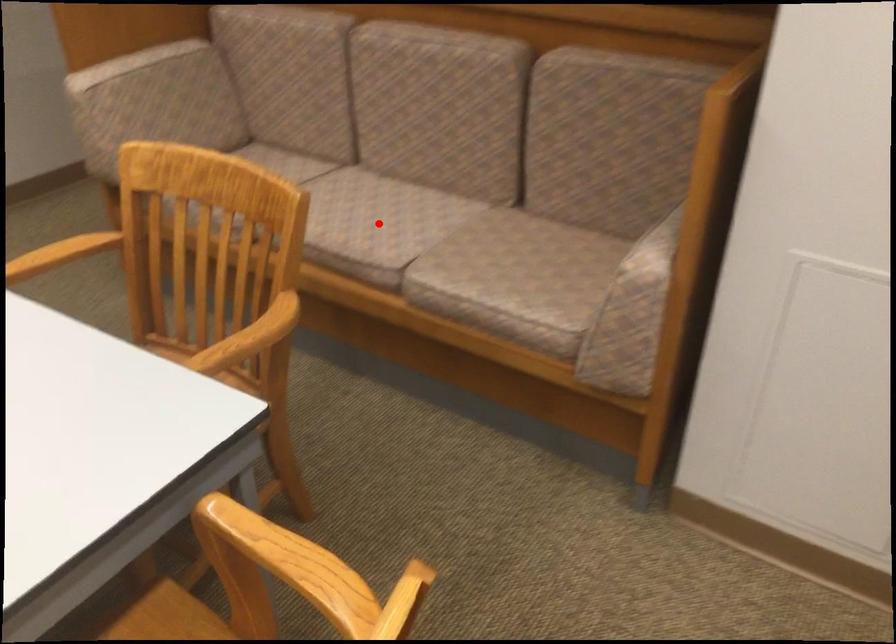
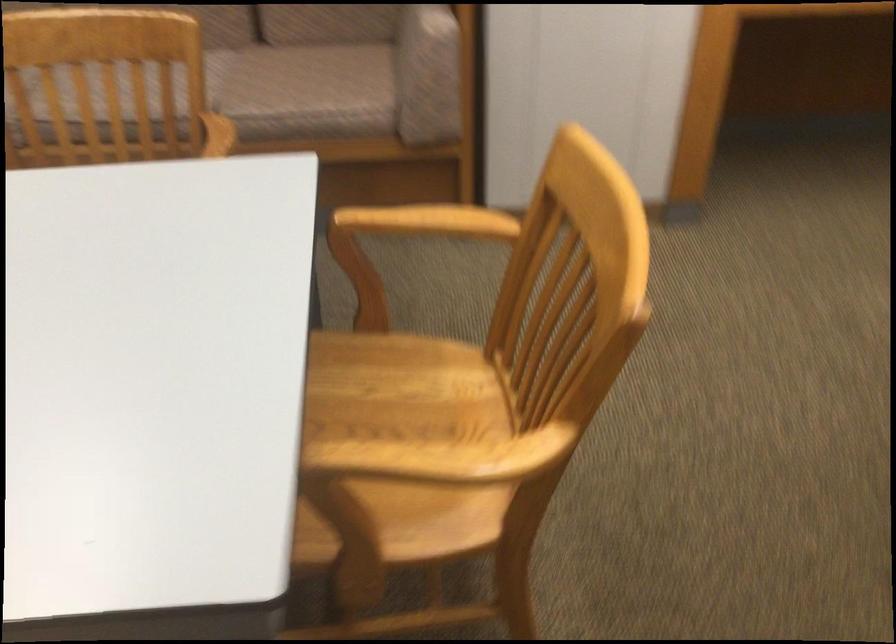
Question: I am providing you with two images of the same scene from different viewpoints. A red point is marked on the first image. Can you still see the location of the red point in image 2?

Choices:
 (A) Yes
 (B) No

Answer: (B)